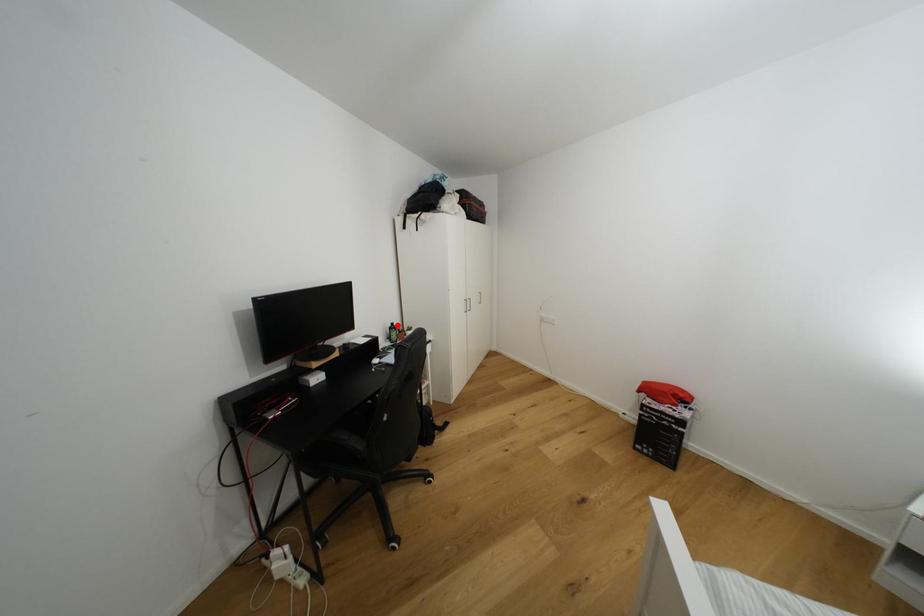
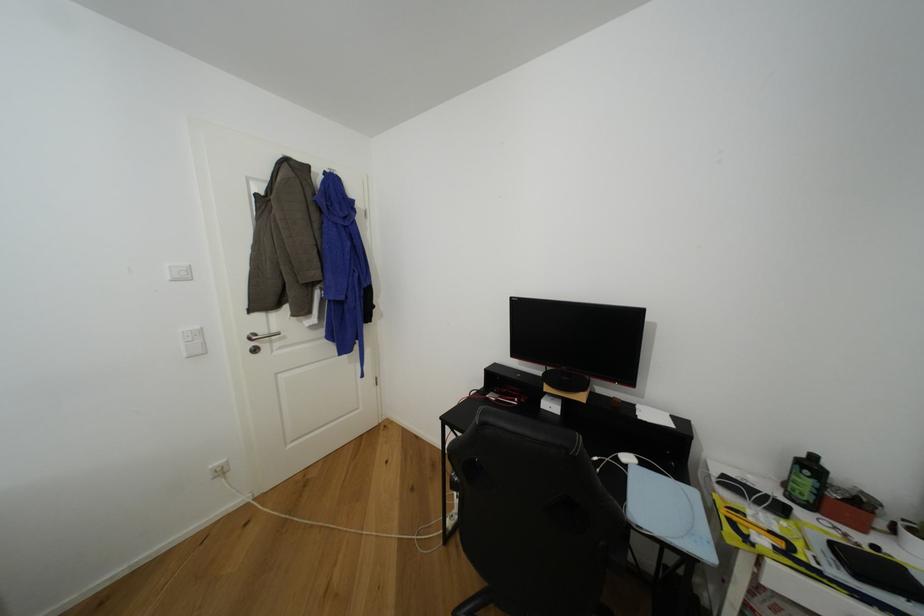
Where in the second image is the point corresponding to the highlighted location from the first image?

(820, 459)